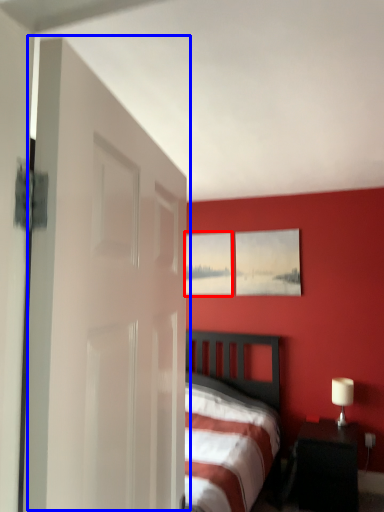
Question: Among these objects, which one is farthest to the camera, picture frame (highlighted by a red box) or door (highlighted by a blue box)?

Choices:
 (A) picture frame
 (B) door

Answer: (A)